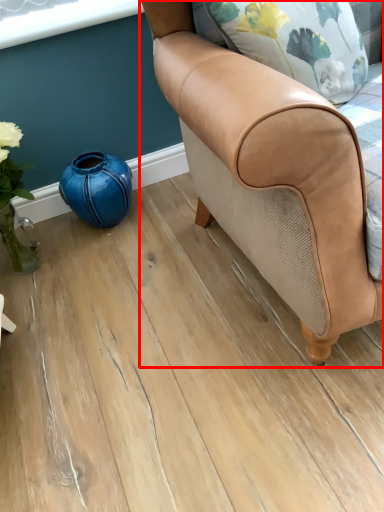
Question: From the image's perspective, considering the relative positions of chair (annotated by the red box) and teal in the image provided, where is chair (annotated by the red box) located with respect to the staircase?

Choices:
 (A) above
 (B) below

Answer: (A)